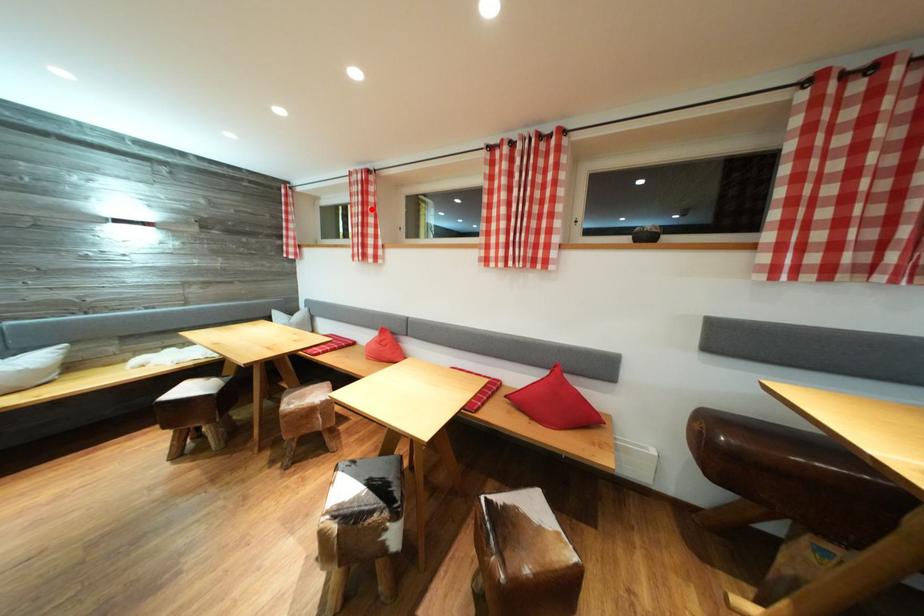
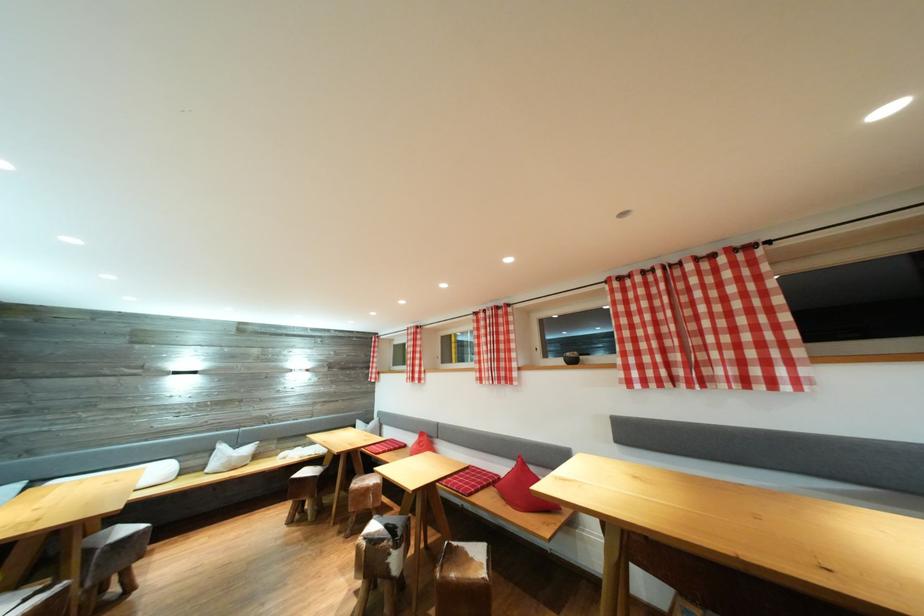
Where in the second image is the point corresponding to the highlighted location from the first image?

(421, 351)